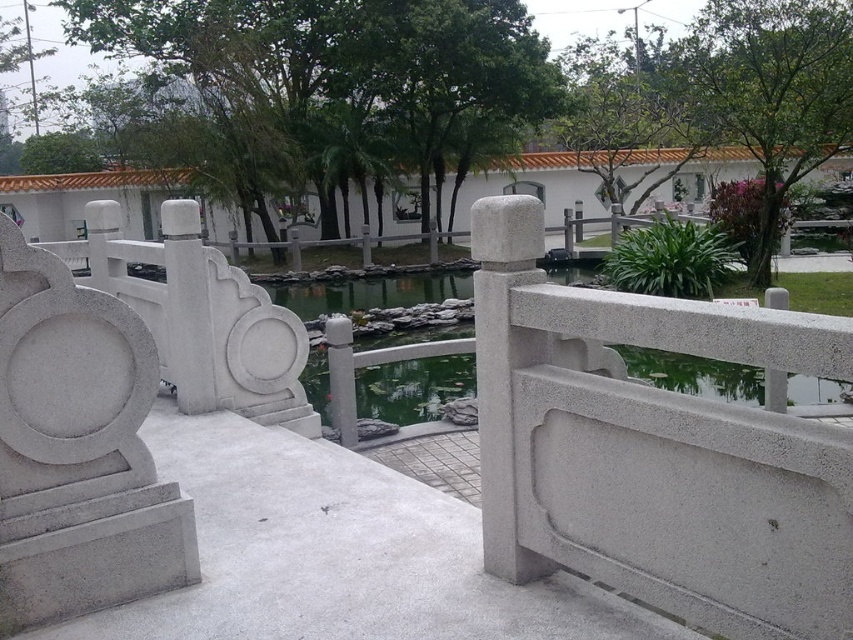
You are a maintenance worker needing to replace a loose stone from the gray stone railing at center to the white stone railing at left. Can you move the stone without it falling between them?

The gray stone railing at center and white stone railing at left are 81.28 centimeters apart, so the stone can be moved safely without falling between them as the distance is sufficient.

You are standing on the stone bridge and want to reach the gray stone railing at center. Can you walk directly to the point at coordinates point (337, 554)?

Yes, you can walk directly to the point at coordinates point (337, 554) because it is located on the gray stone railing at center, which is part of the bridge structure.